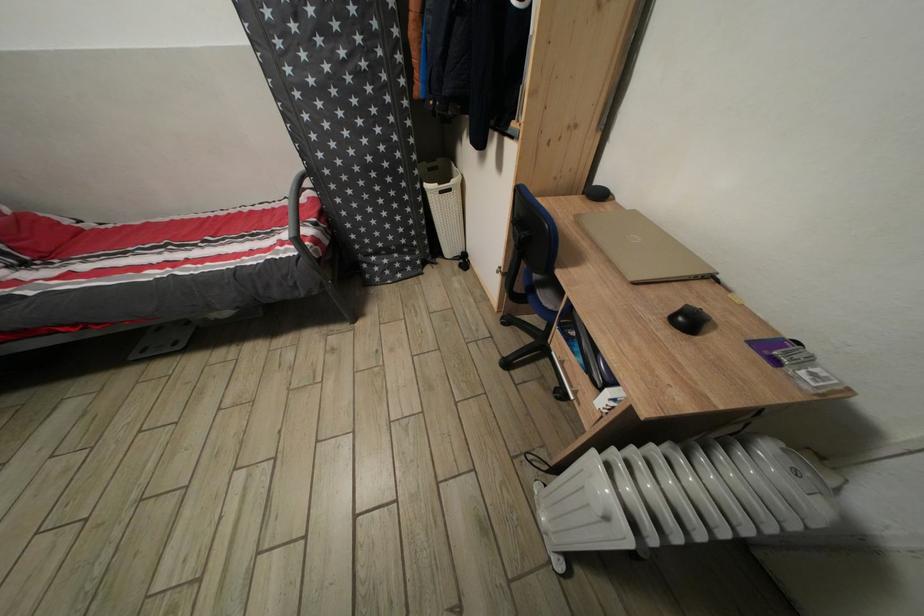
Identify the location of small cabinet knob. (500, 270).